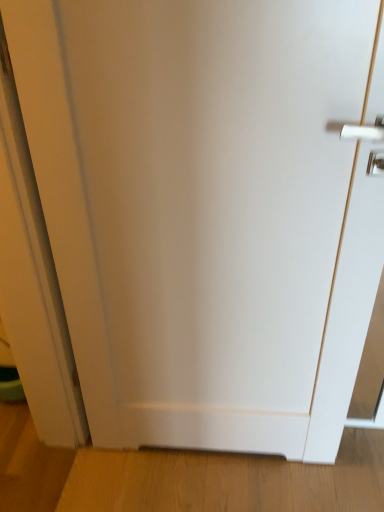
Where is `white matte door at left`? Image resolution: width=384 pixels, height=512 pixels. white matte door at left is located at coordinates (33, 284).

Describe the element at coordinates (33, 284) in the screenshot. I see `white matte door at left` at that location.

Where is `white matte door at left`? white matte door at left is located at coordinates (33, 284).